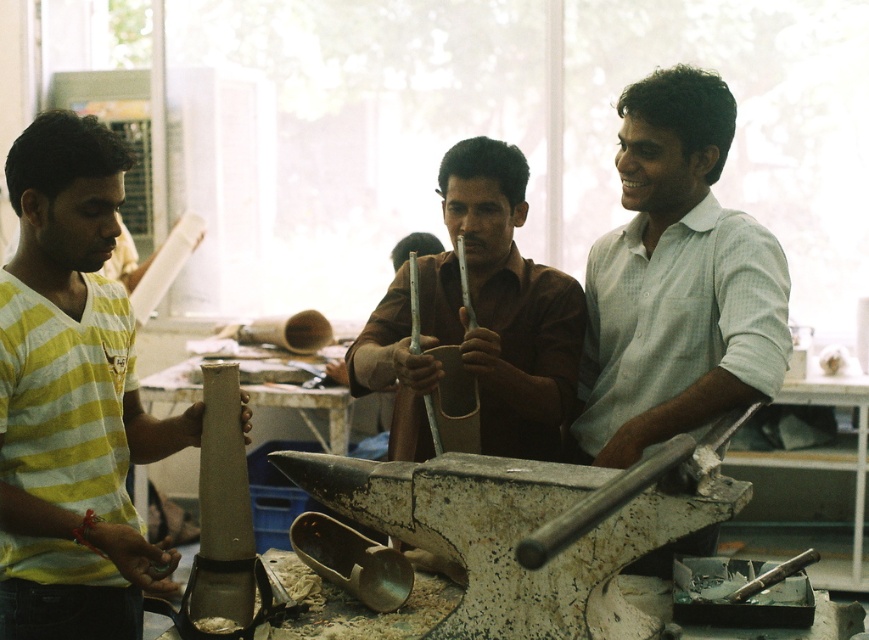
From the picture: You are standing in the workshop and need to locate the yellow striped shirt at left. According to the coordinates provided, where exactly is it positioned?

The yellow striped shirt at left is located at point 0.623 along the x axis and 0.084 along the y axis.

Consider the image. You are an apprentice blacksmith observing two shirts in the workshop. The yellow striped shirt at left and the white checkered shirt at center. From your perspective, which shirt is closer to you?

The yellow striped shirt at left is closer because it is in front of the white checkered shirt at center.

You are a worker in the workshop and need to find the yellow striped shirt at left. Which direction should you look relative to the white checkered shirt at center?

The yellow striped shirt at left is positioned under the white checkered shirt at center, so you should look downward from the white checkered shirt at center to find it.